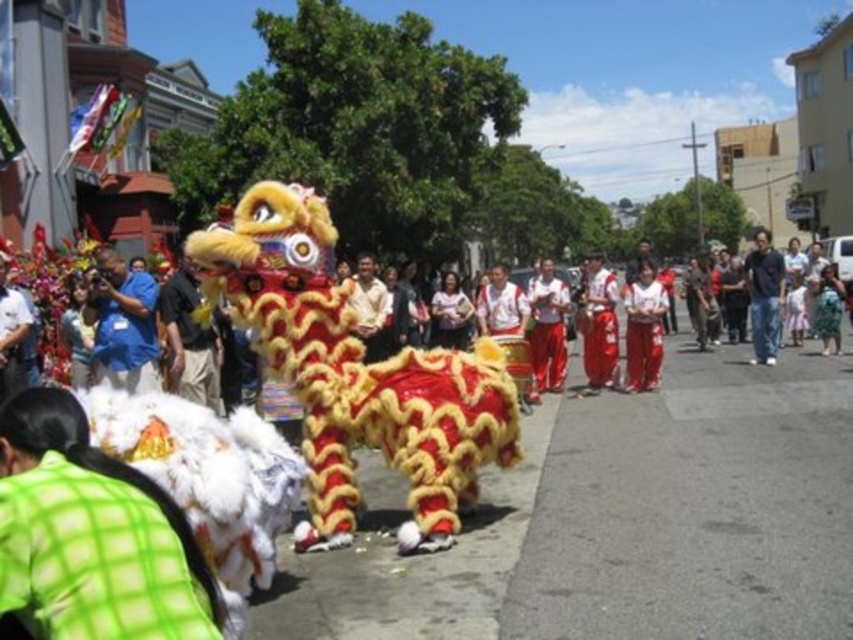
You are a photographer positioned at the front of the crowd capturing the lion dance performance. You notice the matte red pants at center and the dark blue shirt at center in your frame. Which clothing item is closer to your camera lens?

The matte red pants at center is in front of the dark blue shirt at center, so the matte red pants at center is closer to the camera lens.

You are a photographer at the Chinese New Year festival. You want to capture a photo of the fuzzy red lion at center and the white cotton pants at center. From the photographer perspective, which object is positioned to the left?

The fuzzy red lion at center is positioned to the left of the white cotton pants at center according to the description.

You are a photographer at the Chinese New Year festival. You want to take a photo of the lion dance performers. In the scene, you see the matte red pants at center and the dark blue shirt at center. Which piece of clothing is positioned to the left when facing the performers?

The matte red pants at center are to the left of the dark blue shirt at center.